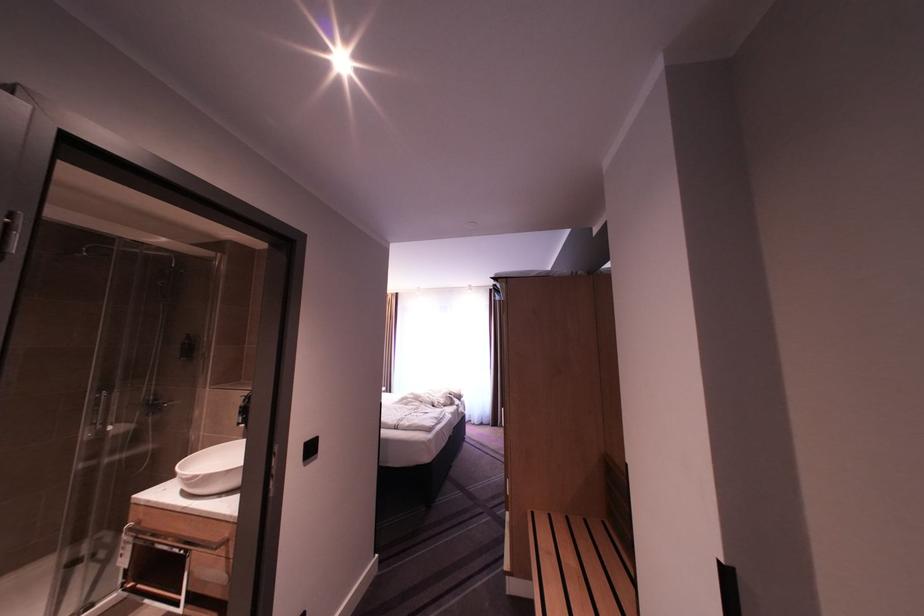
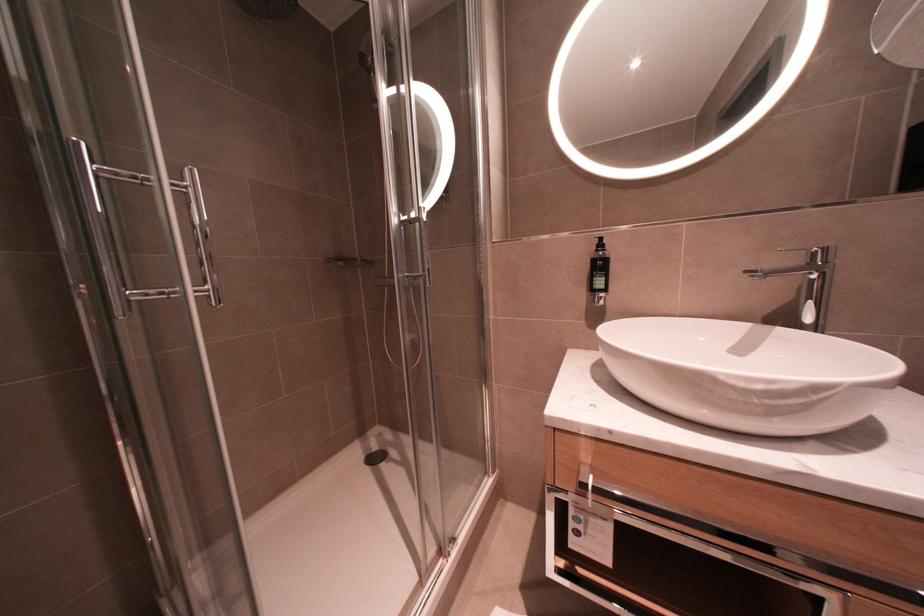
In a continuous first-person perspective shot, in which direction is the camera moving?

The movement direction of the cameraman is left, forward.